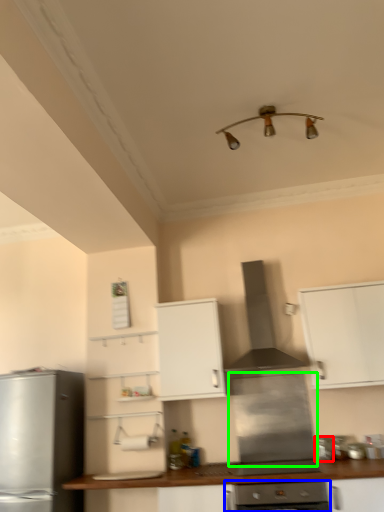
Question: Which object is the farthest from appliance (highlighted by a red box)? Choose among these: oven (highlighted by a blue box) or appliance (highlighted by a green box).

Choices:
 (A) oven
 (B) appliance

Answer: (A)